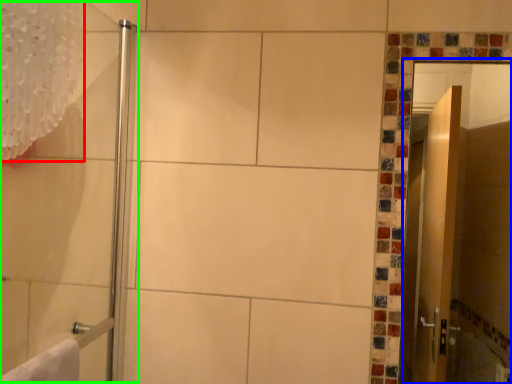
Question: Based on their relative distances, which object is farther from shower curtain (highlighted by a red box)? Choose from screen door (highlighted by a blue box) and shower door (highlighted by a green box).

Choices:
 (A) screen door
 (B) shower door

Answer: (A)